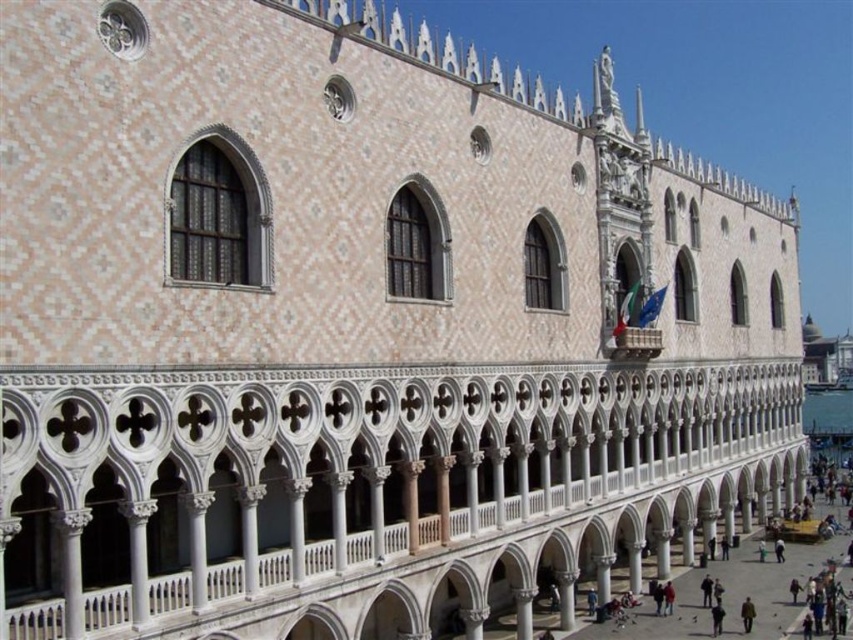
Based on the photo, you are standing in front of the grand architectural structure described. There is a white stone balcony at center. Can you estimate its position relative to the center of the building using coordinates?

The white stone balcony at center is located at coordinates approximately 0.762 on the horizontal axis and 0.430 on the vertical axis relative to the building.